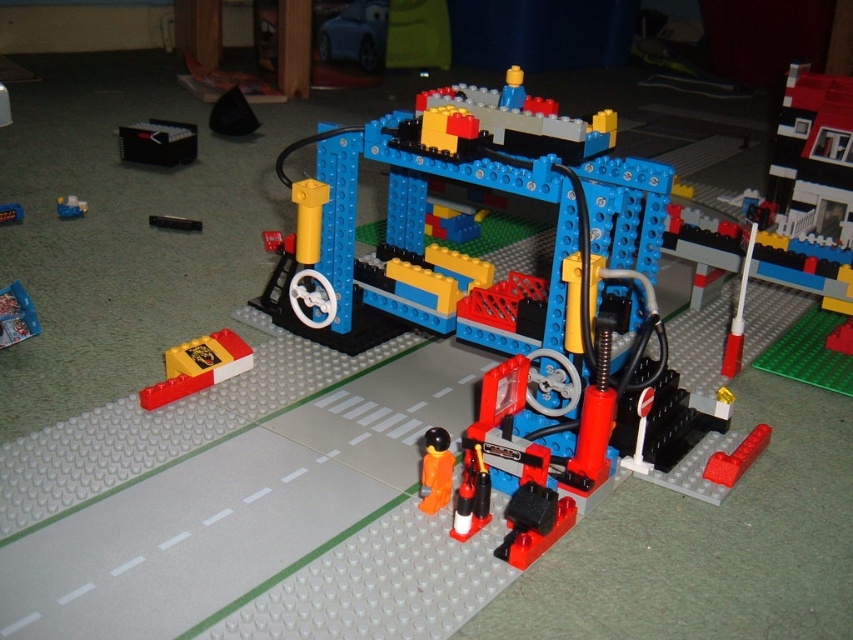
Question: Is brick yellow plastic toy at lower left positioned at the back of blue plastic toy at center?

Choices:
 (A) no
 (B) yes

Answer: (A)

Question: Can you confirm if black plastic remote control at upper left is positioned below brick yellow plastic toy at lower left?

Choices:
 (A) no
 (B) yes

Answer: (A)

Question: Among these points, which one is nearest to the camera?

Choices:
 (A) (195, 358)
 (B) (3, 305)
 (C) (84, 209)
 (D) (20, 218)

Answer: (A)

Question: Which object is the closest to the black plastic remote control at upper left?

Choices:
 (A) brick yellow plastic toy at lower left
 (B) orange matte figure at center

Answer: (A)

Question: Which of the following is the closest to the observer?

Choices:
 (A) black plastic remote control at upper left
 (B) brick yellow plastic toy at lower left

Answer: (B)

Question: Is black plastic remote control at upper left bigger than blue plastic toy at center?

Choices:
 (A) yes
 (B) no

Answer: (A)